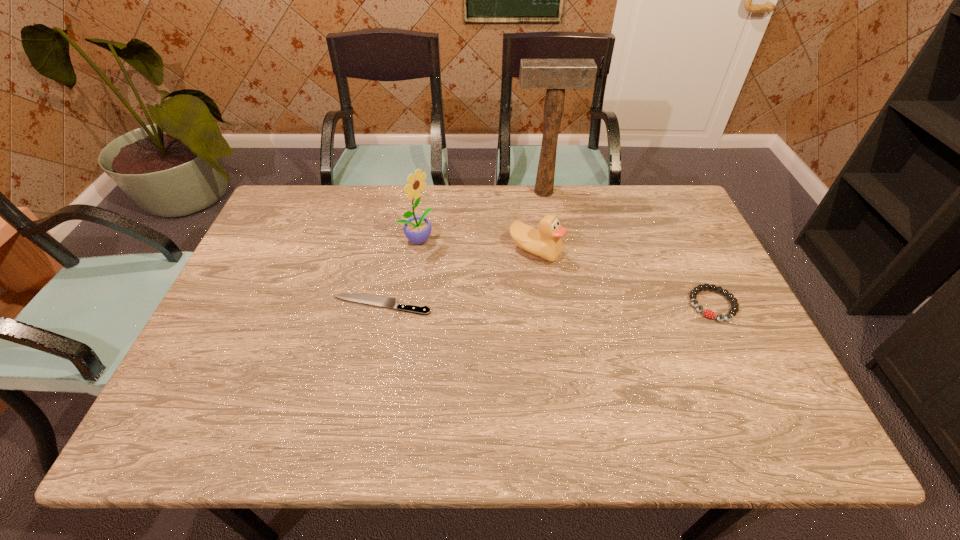
At what (x,y) coordinates should I click in order to perform the action: click on vacant space located 0.270m on the striking surface of the mallet. Please return your answer as a coordinate pair (x, y). Looking at the image, I should click on (554, 253).

Find the location of a particular element. vacant space located 0.290m on the striking surface of the mallet is located at coordinates coord(555,258).

Identify the location of vacant space located 0.090m at the beak of the third tallest object. The image size is (960, 540). (552, 290).

Locate an element on the screen. The width and height of the screenshot is (960, 540). vacant space located 0.110m at the beak of the third tallest object is located at coordinates (555, 295).

This screenshot has width=960, height=540. I want to click on free location located 0.230m at the beak of the third tallest object, so click(569, 331).

The width and height of the screenshot is (960, 540). In order to click on free spot located on the front-facing side of the sunflower in this screenshot , I will do `click(515, 289)`.

Locate an element on the screen. The image size is (960, 540). free spot located on the front-facing side of the sunflower is located at coordinates (491, 276).

Locate an element on the screen. The width and height of the screenshot is (960, 540). free space located on the front-facing side of the sunflower is located at coordinates (505, 285).

The width and height of the screenshot is (960, 540). In order to click on mallet that is at the far edge in this screenshot , I will do `click(555, 75)`.

Locate an element on the screen. This screenshot has width=960, height=540. sunflower at the far edge is located at coordinates (417, 229).